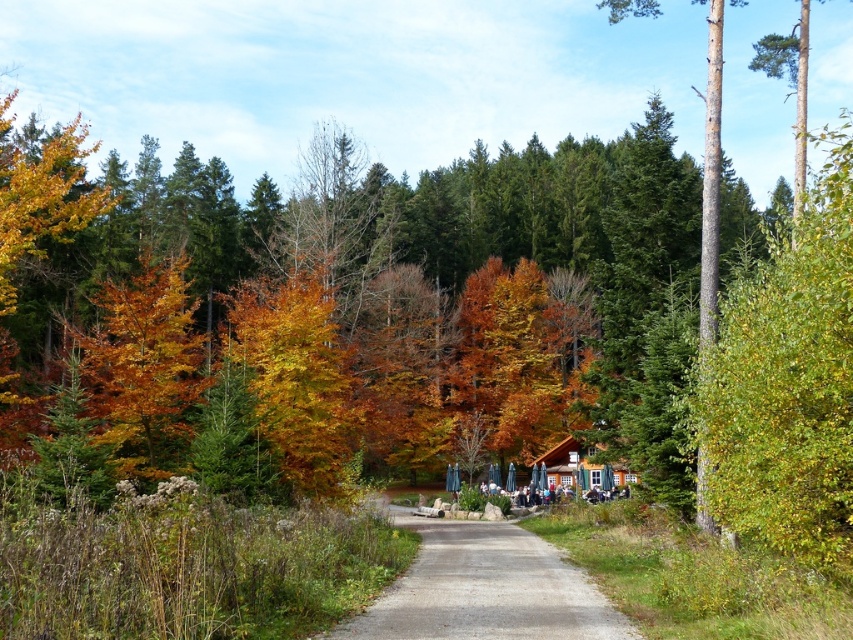
Question: Which object is closer to the camera taking this photo?

Choices:
 (A) wooden cabin at center
 (B) gray concrete path at center

Answer: (B)

Question: From the image, what is the correct spatial relationship of gray concrete path at center in relation to wooden cabin at center?

Choices:
 (A) below
 (B) above

Answer: (B)

Question: Is gray concrete path at center further to camera compared to wooden cabin at center?

Choices:
 (A) yes
 (B) no

Answer: (B)

Question: Which of the following is the farthest from the observer?

Choices:
 (A) gray concrete path at center
 (B) wooden cabin at center

Answer: (B)

Question: Considering the relative positions of gray concrete path at center and wooden cabin at center in the image provided, where is gray concrete path at center located with respect to wooden cabin at center?

Choices:
 (A) left
 (B) right

Answer: (A)